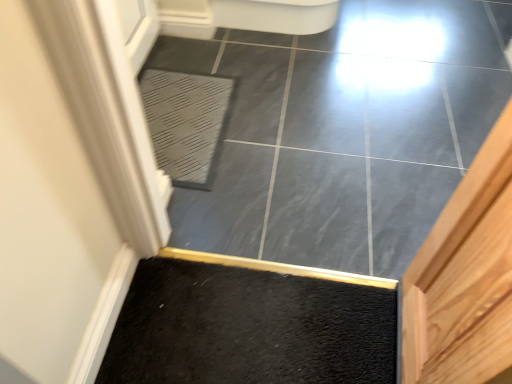
Question: Does point (208, 160) appear closer or farther from the camera than point (321, 39)?

Choices:
 (A) closer
 (B) farther

Answer: (A)

Question: From a real-world perspective, is gray textured bath mat at center above or below slate gray tile at center?

Choices:
 (A) above
 (B) below

Answer: (A)

Question: In the image, is gray textured bath mat at center positioned in front of or behind slate gray tile at center?

Choices:
 (A) front
 (B) behind

Answer: (B)

Question: Considering their positions, is slate gray tile at center located in front of or behind gray textured bath mat at center?

Choices:
 (A) front
 (B) behind

Answer: (A)

Question: Does point (287, 225) appear closer or farther from the camera than point (158, 150)?

Choices:
 (A) closer
 (B) farther

Answer: (A)

Question: Considering the positions of slate gray tile at center and gray textured bath mat at center in the image, is slate gray tile at center wider or thinner than gray textured bath mat at center?

Choices:
 (A) wide
 (B) thin

Answer: (A)

Question: Visually, is slate gray tile at center positioned to the left or to the right of gray textured bath mat at center?

Choices:
 (A) left
 (B) right

Answer: (B)